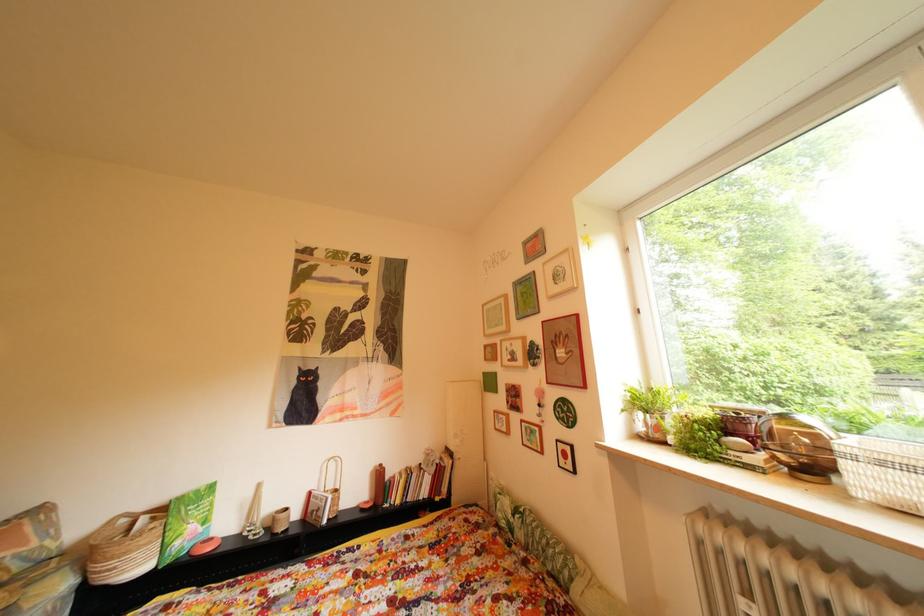
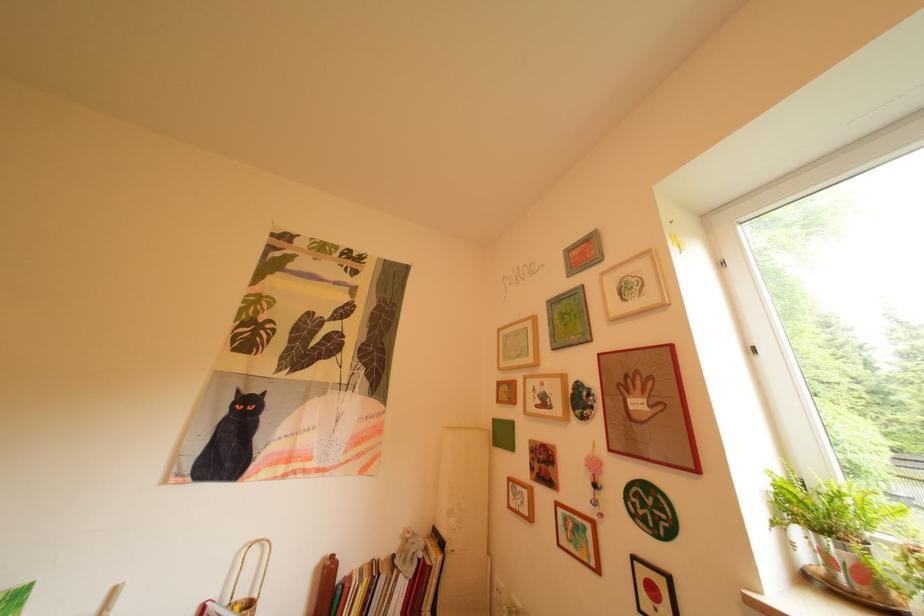
Question: The first image is from the beginning of the video and the second image is from the end. How did the camera likely rotate when shooting the video?

Choices:
 (A) Left
 (B) Right
 (C) Up
 (D) Down

Answer: (C)